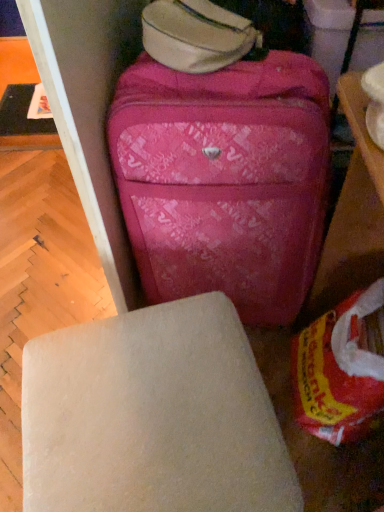
Question: Should I look upward or downward to see black plastic table at upper left, marked as the second table in a front-to-back arrangement?

Choices:
 (A) up
 (B) down

Answer: (A)

Question: Considering the relative sizes of pink fabric suitcase at center and matte white table at upper right, marked as the second table in a top-to-bottom arrangement, in the image provided, is pink fabric suitcase at center bigger than matte white table at upper right, marked as the second table in a top-to-bottom arrangement,?

Choices:
 (A) no
 (B) yes

Answer: (B)

Question: Does pink fabric suitcase at center appear on the right side of matte white table at upper right, placed as the first table when sorted from right to left?

Choices:
 (A) no
 (B) yes

Answer: (A)

Question: Can you confirm if pink fabric suitcase at center is positioned to the left of matte white table at upper right, arranged as the second table when viewed from the left?

Choices:
 (A) no
 (B) yes

Answer: (B)

Question: From a real-world perspective, is pink fabric suitcase at center on matte white table at upper right, placed as the first table when sorted from right to left?

Choices:
 (A) yes
 (B) no

Answer: (B)

Question: From the image's perspective, would you say pink fabric suitcase at center is shown under matte white table at upper right, placed as the first table when sorted from right to left?

Choices:
 (A) no
 (B) yes

Answer: (B)

Question: Are pink fabric suitcase at center and matte white table at upper right, marked as the second table in a top-to-bottom arrangement, beside each other?

Choices:
 (A) no
 (B) yes

Answer: (A)

Question: Can you confirm if white matte stool at center is wider than matte white table at upper right, marked as the second table in a top-to-bottom arrangement?

Choices:
 (A) yes
 (B) no

Answer: (A)

Question: From the image's perspective, is white matte stool at center on matte white table at upper right, placed as the first table when sorted from right to left?

Choices:
 (A) no
 (B) yes

Answer: (A)

Question: Can you confirm if white matte stool at center is thinner than matte white table at upper right, acting as the 1th table starting from the bottom?

Choices:
 (A) yes
 (B) no

Answer: (B)

Question: Is white matte stool at center positioned beyond the bounds of matte white table at upper right, acting as the 1th table starting from the bottom?

Choices:
 (A) no
 (B) yes

Answer: (B)

Question: Does white matte stool at center lie behind matte white table at upper right, the first table positioned from the front?

Choices:
 (A) no
 (B) yes

Answer: (B)

Question: Does white matte stool at center come in front of matte white table at upper right, acting as the 1th table starting from the bottom?

Choices:
 (A) yes
 (B) no

Answer: (B)

Question: Does matte white table at upper right, which is the second table from back to front, have a smaller size compared to black plastic table at upper left, marked as the second table in a right-to-left arrangement?

Choices:
 (A) no
 (B) yes

Answer: (A)